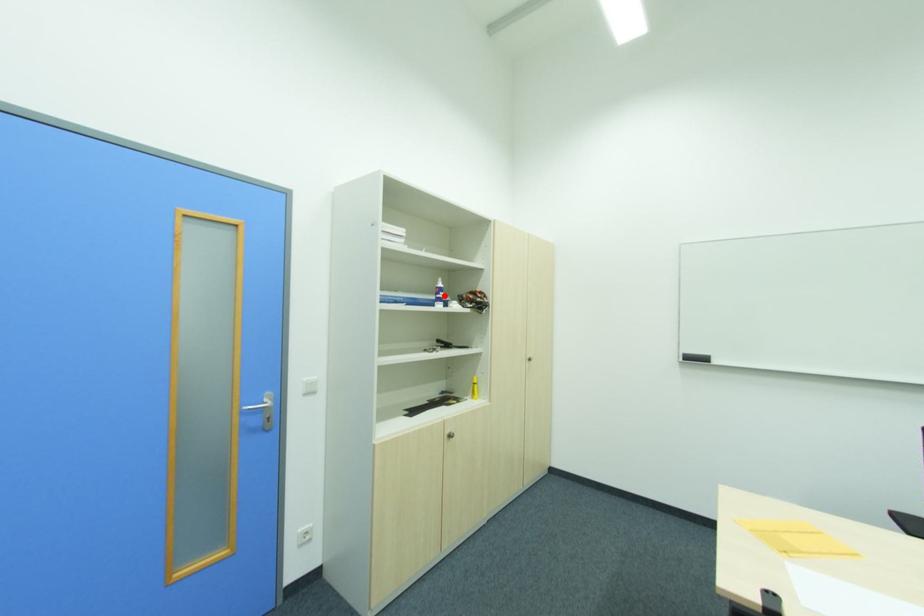
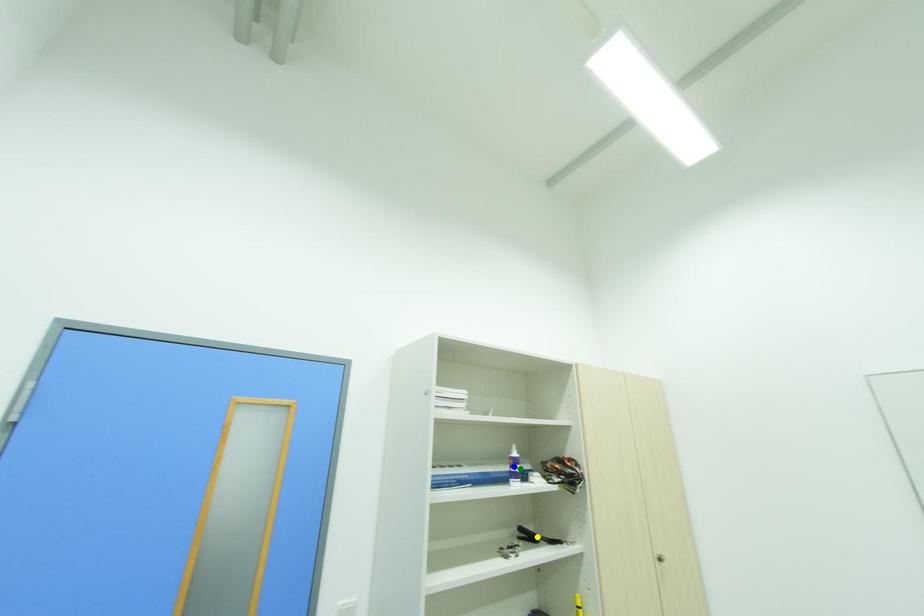
Question: I am providing you with two images of the same scene from different viewpoints. A red point is marked on the first image. You are given multiple points on the second image. Which spot in image 2 lines up with the point in image 1?

Choices:
 (A) yellow point
 (B) green point
 (C) blue point

Answer: (B)